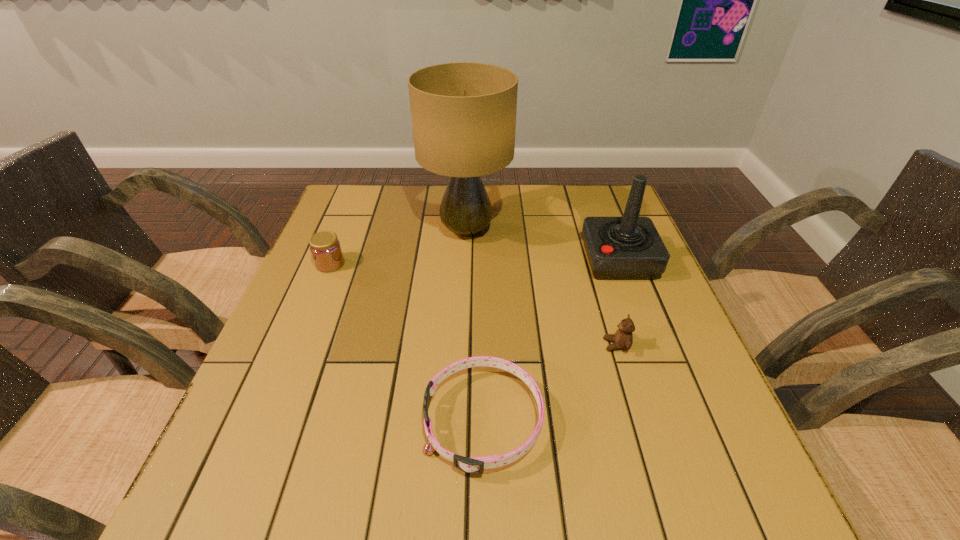
I want to click on lampshade, so click(463, 114).

This screenshot has height=540, width=960. What are the coordinates of `the second tallest object` in the screenshot? It's located at (618, 248).

The height and width of the screenshot is (540, 960). I want to click on the leftmost object, so click(326, 251).

The image size is (960, 540). I want to click on the fourth farthest object, so click(x=623, y=339).

Identify the location of the nearest object. Image resolution: width=960 pixels, height=540 pixels. (474, 465).

Find the location of a particular element. the shortest object is located at coordinates (474, 465).

The height and width of the screenshot is (540, 960). Identify the location of blank area located on the right of the lampshade. (591, 231).

The image size is (960, 540). I want to click on free space located 0.170m on the front-facing side of the joystick, so click(519, 260).

Locate an element on the screen. vacant space located on the front-facing side of the joystick is located at coordinates (446, 260).

This screenshot has height=540, width=960. In order to click on free spot located 0.090m on the front-facing side of the joystick in this screenshot , I will do `click(550, 260)`.